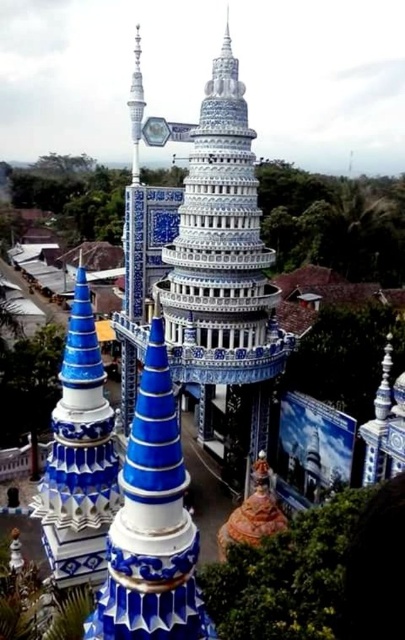
You are standing in front of the towers and want to determine which of the two points, point [61,412] or point [142,97], is nearer to you. Based on the scene, which point is closer?

Point [61,412] is closer to the viewer than point [142,97].

In the scene shown: You are a drone operator trying to capture aerial footage of the blue glossy tower at center and the white glossy spire at upper center. Based on the scene, can you determine which object is higher in the image?

The white glossy spire at upper center is higher than the blue glossy tower at center because it is positioned above it in the image.

You are standing at the origin point in the image. Which direction should you move to reach the blue glossy tower at center?

The blue glossy tower at center is located at coordinates 0.714 on the x axis and 0.195 on the y axis. To reach it from the origin, you should move towards the right and slightly downward.